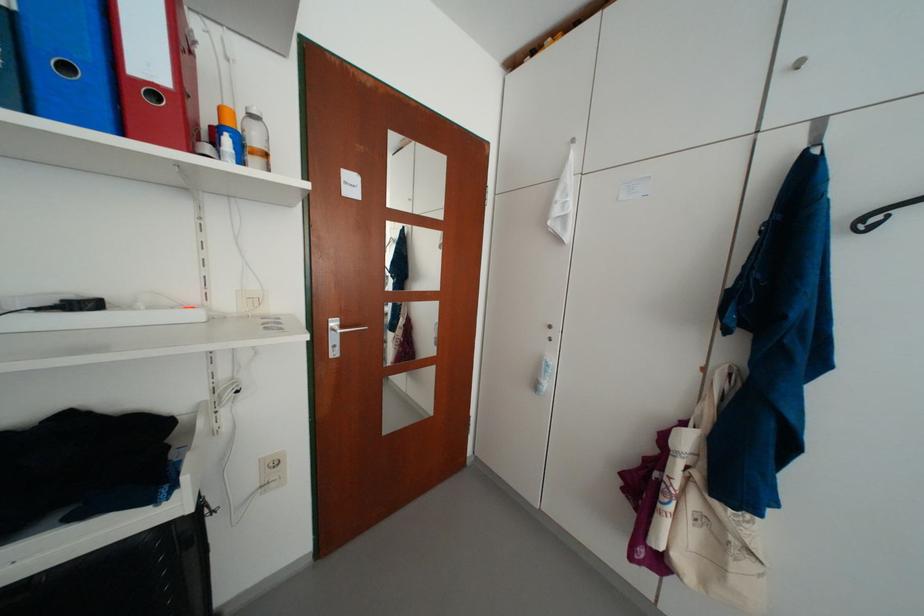
At what (x,y) coordinates should I click in order to perform the action: click on clear plastic bottle. Please return your answer as a coordinate pair (x, y). Looking at the image, I should click on (254, 139).